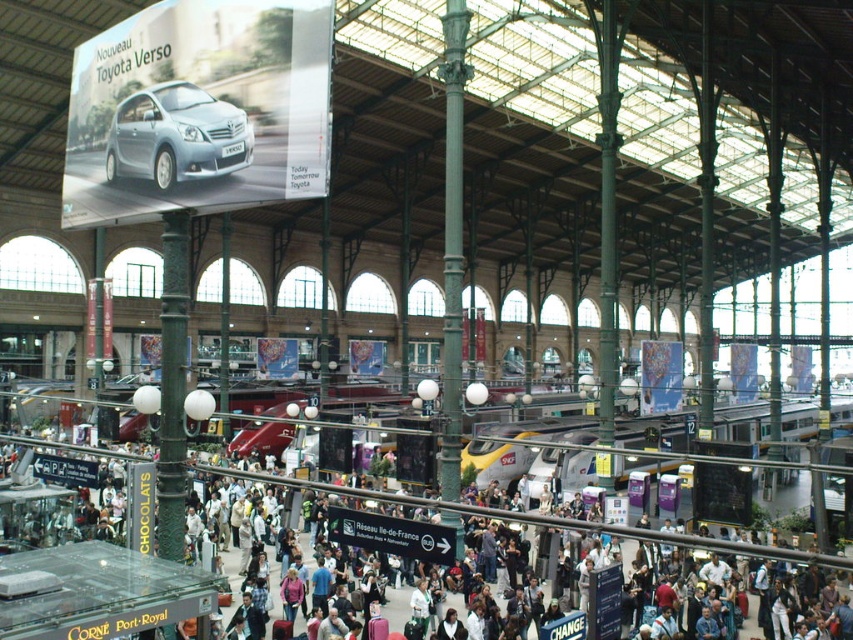
Between silver metallic car at upper left and matte black crowd at center, which one has less height?

With less height is silver metallic car at upper left.

In the scene shown: Can you confirm if silver metallic car at upper left is positioned above matte black crowd at center?

Yes, silver metallic car at upper left is above matte black crowd at center.

In order to click on silver metallic car at upper left in this screenshot , I will do `click(177, 134)`.

The height and width of the screenshot is (640, 853). What are the coordinates of `silver metallic car at upper left` in the screenshot? It's located at [177, 134].